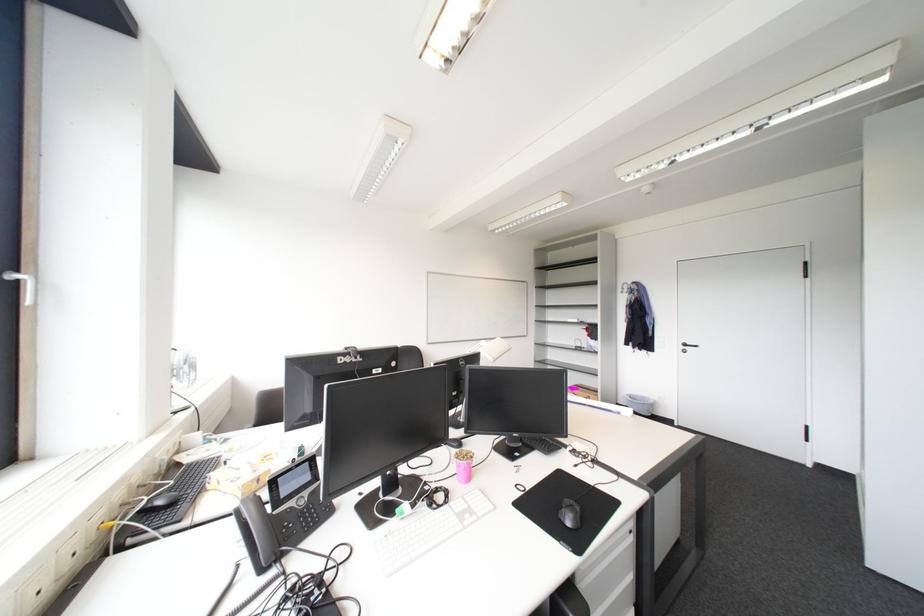
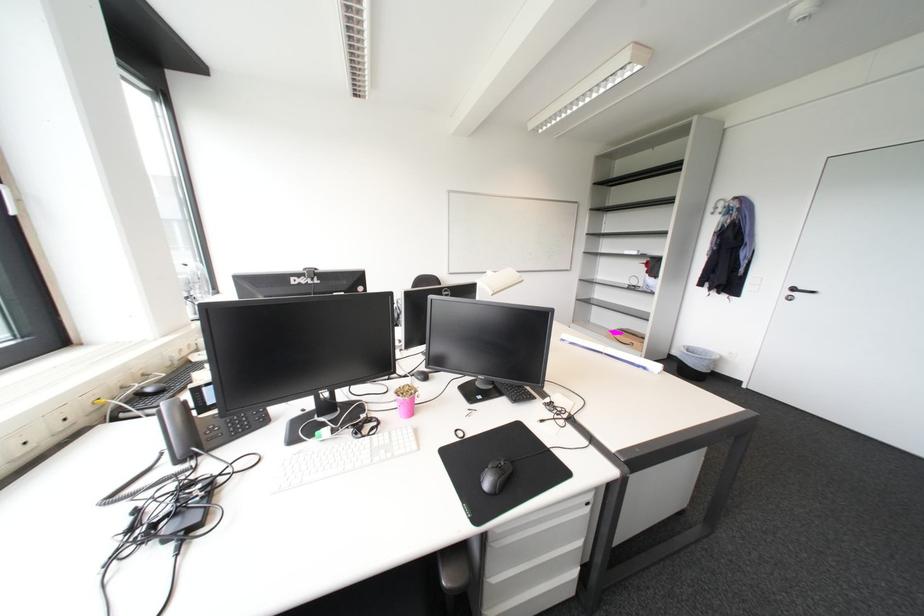
Locate, in the second image, the point that corresponds to (657,406) in the first image.

(716, 361)